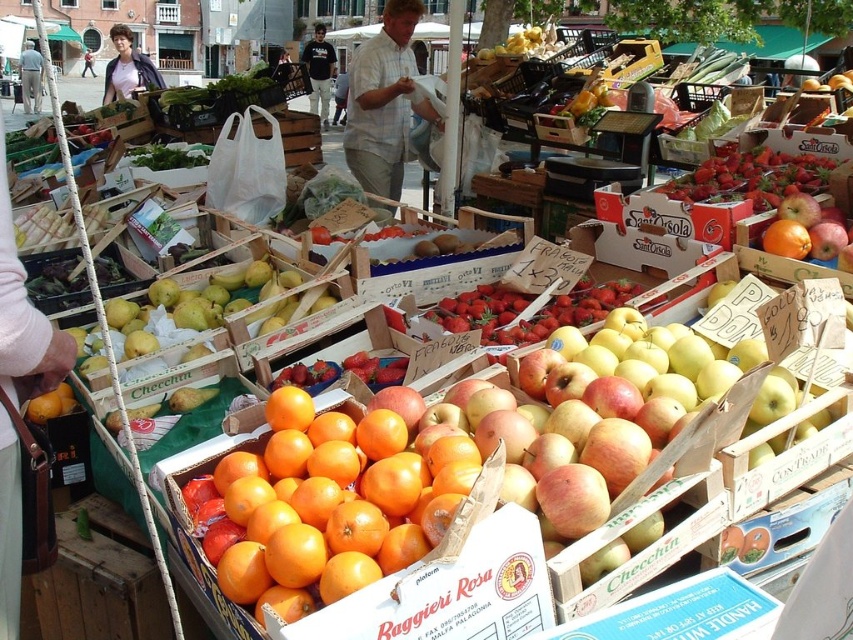
Can you confirm if red matte strawberries at center is positioned below matte white shirt at center?

Correct, red matte strawberries at center is located below matte white shirt at center.

Can you confirm if red matte strawberries at center is bigger than matte white shirt at center?

Actually, red matte strawberries at center might be smaller than matte white shirt at center.

Between point (772, 163) and point (141, 52), which one is positioned in front?

Positioned in front is point (772, 163).

Where is `red matte strawberries at center`? The height and width of the screenshot is (640, 853). red matte strawberries at center is located at coordinates (751, 177).

Is shiny red apple at center wider than shiny red strawberries at center?

No.

Who is lower down, shiny red apple at center or shiny red strawberries at center?

shiny red strawberries at center

Does point (813, 209) lie in front of point (497, 312)?

Yes, it is.

Identify the location of shiny red apple at center. (807, 230).

Who is higher up, light blue plaid shirt at center or matte white shirt at center?

matte white shirt at center is higher up.

Between light blue plaid shirt at center and matte white shirt at center, which one appears on the left side from the viewer's perspective?

matte white shirt at center

What do you see at coordinates (383, 100) in the screenshot? The width and height of the screenshot is (853, 640). I see `light blue plaid shirt at center` at bounding box center [383, 100].

Locate an element on the screen. light blue plaid shirt at center is located at coordinates pyautogui.click(x=383, y=100).